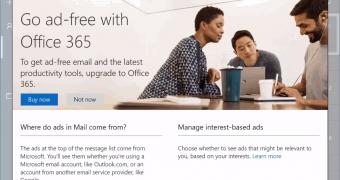
In order to click on macbook in this screenshot , I will do `click(249, 76)`.